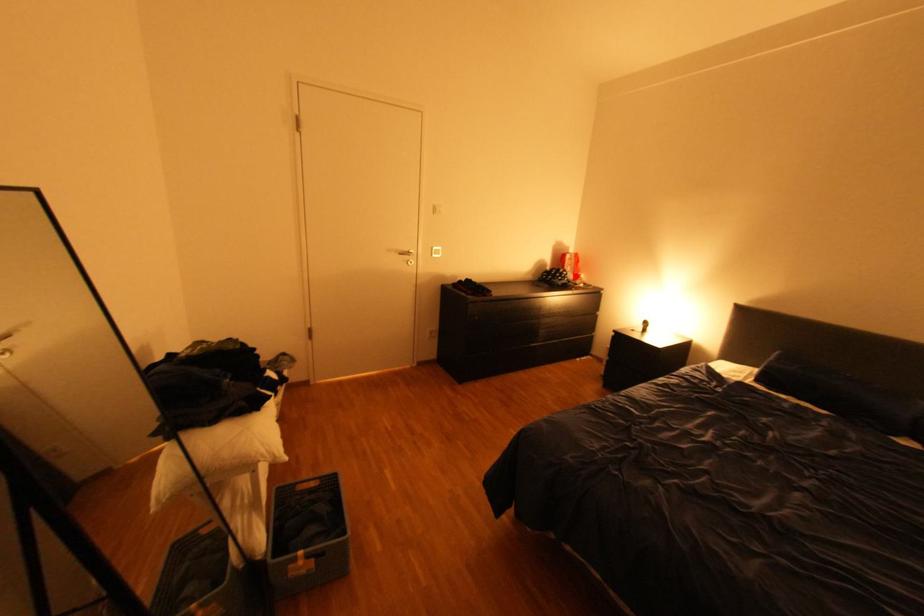
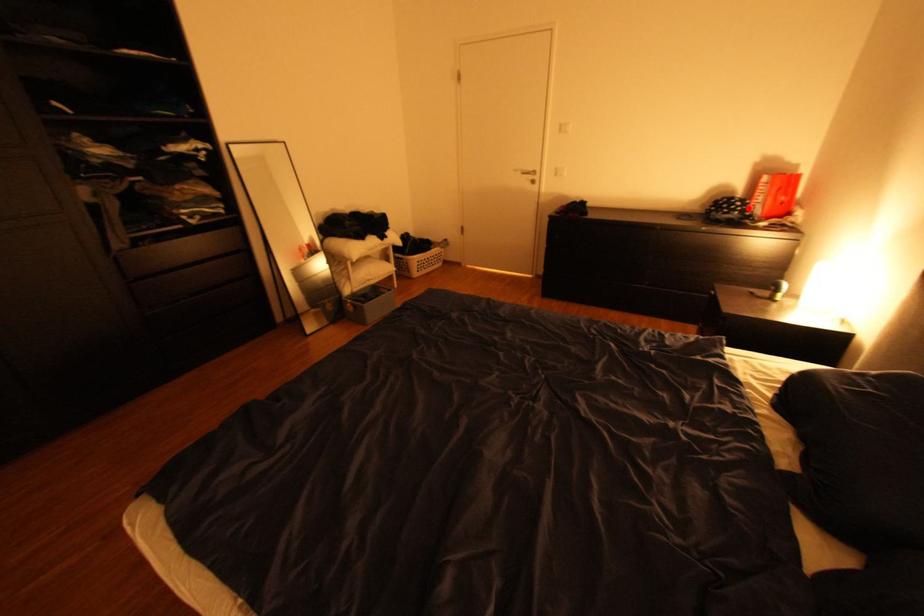
I am providing you with two images of the same scene from different viewpoints. A red point is marked on the first image and another point is marked on the second image. Is the red point in image1 aligned with the point shown in image2?

Yes